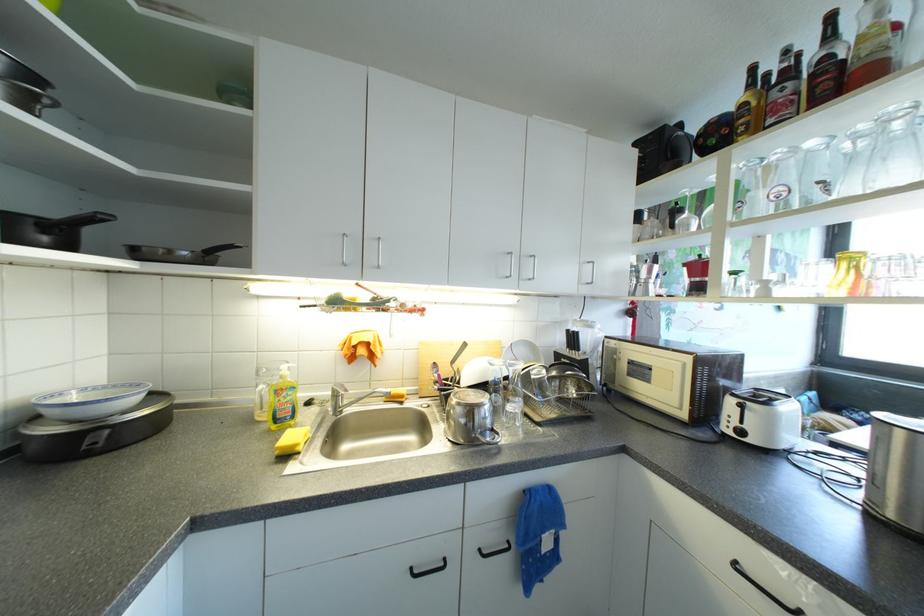
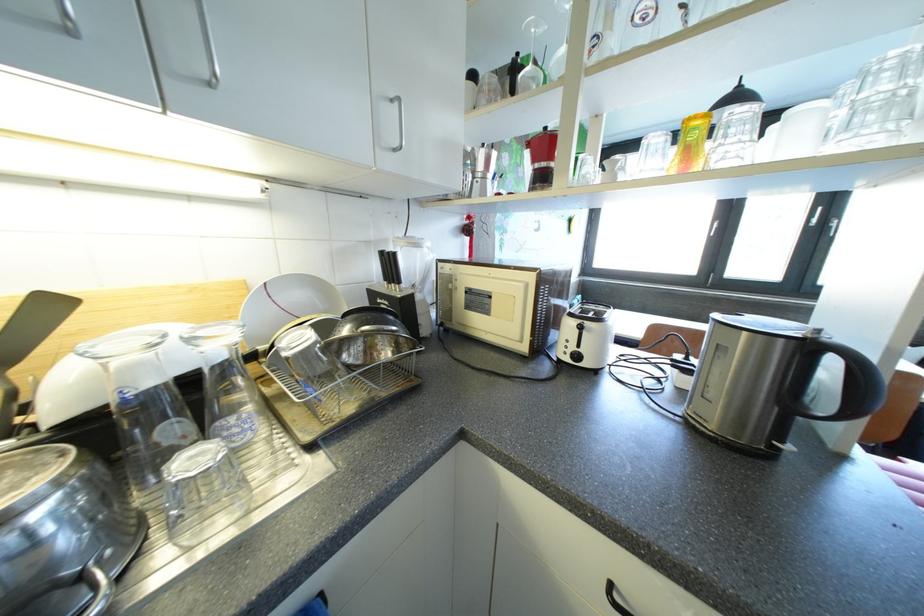
Find the pixel in the second image that matches (x=704, y=298) in the first image.

(549, 192)